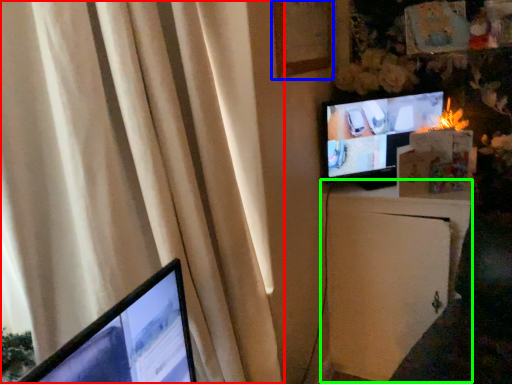
Question: Estimate the real-world distances between objects in this image. Which object is farther from curtain (highlighted by a red box), picture frame (highlighted by a blue box) or file cabinet (highlighted by a green box)?

Choices:
 (A) picture frame
 (B) file cabinet

Answer: (B)